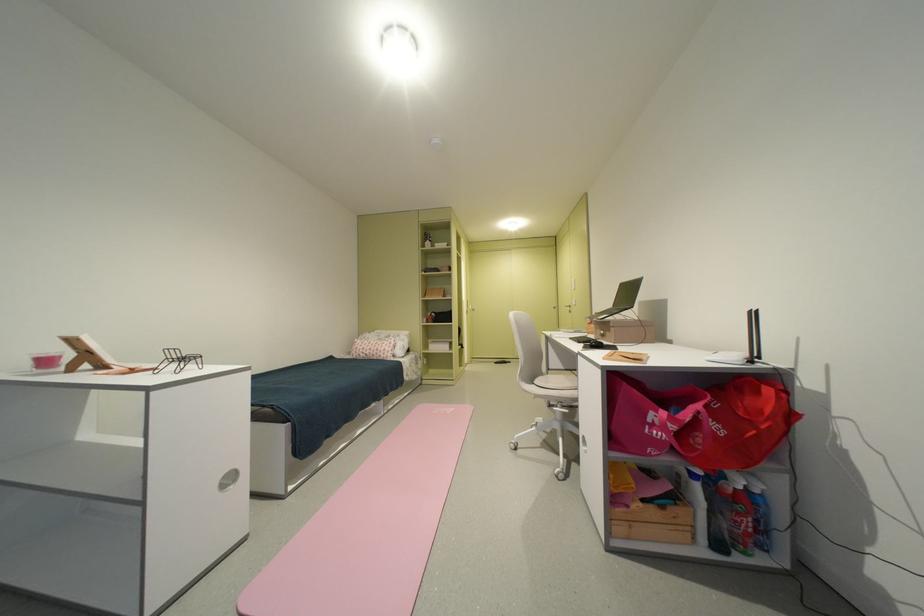
The height and width of the screenshot is (616, 924). What do you see at coordinates (622, 318) in the screenshot?
I see `the laptop` at bounding box center [622, 318].